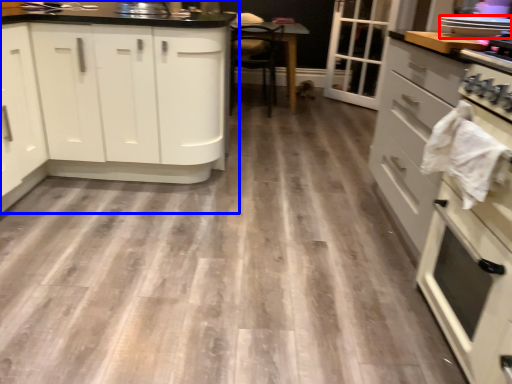
Question: Which point is further to the camera, kitchen appliance (highlighted by a red box) or cabinetry (highlighted by a blue box)?

Choices:
 (A) kitchen appliance
 (B) cabinetry

Answer: (B)